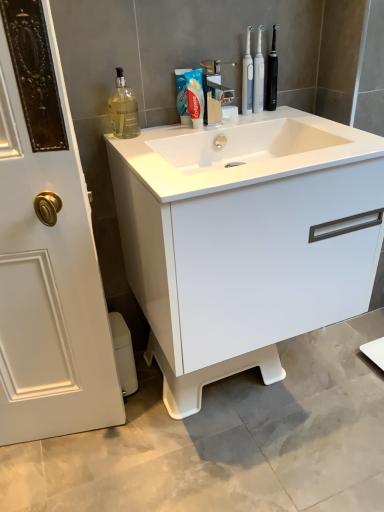
What is the approximate width of clear plastic toothbrushes at upper center?

It is 1.13 inches.

What is the approximate width of white glossy sink at center?

49.85 centimeters.

Where is `black plastic toothbrush at upper right, placed as the 2th toiletry when sorted from left to right`? black plastic toothbrush at upper right, placed as the 2th toiletry when sorted from left to right is located at coordinates (272, 74).

Find the location of `translucent glass bottle at upper left`. translucent glass bottle at upper left is located at coordinates (123, 109).

I want to click on clear plastic toothbrushes at upper center, so click(x=247, y=77).

Can you confirm if translucent glass bottle at upper left is smaller than black plastic toothbrush at upper right, placed as the 2th toiletry when sorted from left to right?

No.

From a real-world perspective, between translucent glass bottle at upper left and black plastic toothbrush at upper right, the 1th toiletry when ordered from right to left, who is vertically higher?

From a 3D spatial view, black plastic toothbrush at upper right, the 1th toiletry when ordered from right to left, is above.

Is there a large distance between translucent glass bottle at upper left and black plastic toothbrush at upper right, the 1th toiletry when ordered from right to left?

No, translucent glass bottle at upper left is in close proximity to black plastic toothbrush at upper right, the 1th toiletry when ordered from right to left.

Could you tell me if translucent glass bottle at upper left is facing black plastic toothbrush at upper right, placed as the 2th toiletry when sorted from left to right?

No, translucent glass bottle at upper left is not turned towards black plastic toothbrush at upper right, placed as the 2th toiletry when sorted from left to right.

Considering the relative positions of matte white electric toothbrushes at upper center, which ranks as the first toiletry in left-to-right order, and white matte toothpaste at center in the image provided, is matte white electric toothbrushes at upper center, which ranks as the first toiletry in left-to-right order, to the right of white matte toothpaste at center from the viewer's perspective?

Indeed, matte white electric toothbrushes at upper center, which ranks as the first toiletry in left-to-right order, is positioned on the right side of white matte toothpaste at center.

Where is `the 1st toiletry directly above the white matte toothpaste at center (from a real-world perspective)`? the 1st toiletry directly above the white matte toothpaste at center (from a real-world perspective) is located at coordinates (258, 76).

Can you confirm if matte white electric toothbrushes at upper center, which ranks as the first toiletry in left-to-right order, is taller than white matte toothpaste at center?

Correct, matte white electric toothbrushes at upper center, which ranks as the first toiletry in left-to-right order, is much taller as white matte toothpaste at center.

Is point (262, 111) closer or farther from the camera than point (201, 86)?

Point (262, 111).

Considering the sizes of objects clear plastic toothbrushes at upper center and white matte toothpaste at center in the image provided, who is bigger, clear plastic toothbrushes at upper center or white matte toothpaste at center?

With larger size is white matte toothpaste at center.

Which object is more forward, clear plastic toothbrushes at upper center or white matte toothpaste at center?

white matte toothpaste at center is in front.

Which object is positioned more to the right, clear plastic toothbrushes at upper center or white matte toothpaste at center?

From the viewer's perspective, clear plastic toothbrushes at upper center appears more on the right side.

Considering their positions, is white glossy sink at center located in front of or behind translucent glass bottle at upper left?

In the image, white glossy sink at center appears in front of translucent glass bottle at upper left.

In terms of width, does white glossy sink at center look wider or thinner when compared to translucent glass bottle at upper left?

In the image, white glossy sink at center appears to be wider than translucent glass bottle at upper left.

Consider the image. How different are the orientations of white glossy sink at center and translucent glass bottle at upper left in degrees?

The angle between the facing direction of white glossy sink at center and the facing direction of translucent glass bottle at upper left is 0.987 degrees.

Which object is closer to the camera, clear plastic toothbrushes at upper center or white glossy cabinet at center?

white glossy cabinet at center is closer to the camera.

How much distance is there between clear plastic toothbrushes at upper center and white glossy cabinet at center?

clear plastic toothbrushes at upper center and white glossy cabinet at center are 18.76 inches apart from each other.

From a real-world perspective, is clear plastic toothbrushes at upper center located higher than white glossy cabinet at center?

Yes, from a real-world perspective, clear plastic toothbrushes at upper center is above white glossy cabinet at center.

Considering the sizes of objects clear plastic toothbrushes at upper center and white glossy cabinet at center in the image provided, who is thinner, clear plastic toothbrushes at upper center or white glossy cabinet at center?

With smaller width is clear plastic toothbrushes at upper center.

Is white matte toothpaste at center in contact with clear plastic toothbrushes at upper center?

No, white matte toothpaste at center is not in contact with clear plastic toothbrushes at upper center.

Looking at this image, from the image's perspective, is white matte toothpaste at center positioned above or below clear plastic toothbrushes at upper center?

white matte toothpaste at center is below clear plastic toothbrushes at upper center.

Is white matte toothpaste at center smaller than clear plastic toothbrushes at upper center?

No.

Which object is further away from the camera, white glossy cabinet at center or matte white electric toothbrushes at upper center, placed as the second toiletry when sorted from right to left?

matte white electric toothbrushes at upper center, placed as the second toiletry when sorted from right to left, is more distant.

Is white glossy cabinet at center at the left side of matte white electric toothbrushes at upper center, which ranks as the first toiletry in left-to-right order?

Indeed, white glossy cabinet at center is positioned on the left side of matte white electric toothbrushes at upper center, which ranks as the first toiletry in left-to-right order.

Looking at their sizes, would you say white glossy cabinet at center is wider or thinner than matte white electric toothbrushes at upper center, which ranks as the first toiletry in left-to-right order?

Considering their sizes, white glossy cabinet at center looks broader than matte white electric toothbrushes at upper center, which ranks as the first toiletry in left-to-right order.

Does point (226, 267) come in front of point (260, 70)?

Yes, point (226, 267) is closer to viewer.

Locate an element on the screen. The height and width of the screenshot is (512, 384). cleaning product directly beneath the black plastic toothbrush at upper right, the 1th toiletry when ordered from right to left (from a real-world perspective) is located at coordinates (123, 109).

Starting from the white matte toothpaste at center, which toiletry is the 1st one to the right? Please provide its 2D coordinates.

[(258, 76)]

Based on their spatial positions, is black plastic toothbrush at upper right, placed as the 2th toiletry when sorted from left to right, or translucent glass bottle at upper left closer to clear plastic toothbrushes at upper center?

black plastic toothbrush at upper right, placed as the 2th toiletry when sorted from left to right, is positioned closer to the anchor clear plastic toothbrushes at upper center.

From the image, which object appears to be nearer to white matte toothpaste at center, black plastic toothbrush at upper right, placed as the 2th toiletry when sorted from left to right, or translucent glass bottle at upper left?

translucent glass bottle at upper left is closer to white matte toothpaste at center.

Looking at the image, which one is located further to translucent glass bottle at upper left, white matte toothpaste at center or matte white electric toothbrushes at upper center, placed as the second toiletry when sorted from right to left?

matte white electric toothbrushes at upper center, placed as the second toiletry when sorted from right to left, is positioned further to the anchor translucent glass bottle at upper left.

Looking at the image, which one is located further to white glossy sink at center, translucent glass bottle at upper left or black plastic toothbrush at upper right, the 1th toiletry when ordered from right to left?

The object further to white glossy sink at center is black plastic toothbrush at upper right, the 1th toiletry when ordered from right to left.

Estimate the real-world distances between objects in this image. Which object is further from white matte toothpaste at center, white plastic toilet bowl at lower left or white glossy cabinet at center?

The object further to white matte toothpaste at center is white plastic toilet bowl at lower left.

From the image, which object appears to be farther from translucent glass bottle at upper left, clear plastic toothbrushes at upper center or black plastic toothbrush at upper right, placed as the 2th toiletry when sorted from left to right?

Based on the image, black plastic toothbrush at upper right, placed as the 2th toiletry when sorted from left to right, appears to be further to translucent glass bottle at upper left.

Based on their spatial positions, is translucent glass bottle at upper left or white plastic toilet bowl at lower left closer to white glossy cabinet at center?

translucent glass bottle at upper left lies closer to white glossy cabinet at center than the other object.

When comparing their distances from white plastic toilet bowl at lower left, does white glossy sink at center or clear plastic toothbrushes at upper center seem closer?

Among the two, white glossy sink at center is located nearer to white plastic toilet bowl at lower left.

Locate an element on the screen. toothpaste between black plastic toothbrush at upper right, placed as the 2th toiletry when sorted from left to right, and white plastic toilet bowl at lower left in the up-down direction is located at coordinates (195, 100).

Where is `counter top between black plastic toothbrush at upper right, the 1th toiletry when ordered from right to left, and white glossy cabinet at center vertically`? The width and height of the screenshot is (384, 512). counter top between black plastic toothbrush at upper right, the 1th toiletry when ordered from right to left, and white glossy cabinet at center vertically is located at coordinates (241, 152).

I want to click on cleaning product between white glossy sink at center and white matte toothpaste at center along the z-axis, so click(123, 109).

The width and height of the screenshot is (384, 512). I want to click on toiletry that lies between black plastic toothbrush at upper right, the 1th toiletry when ordered from right to left, and white plastic toilet bowl at lower left from top to bottom, so pos(258,76).